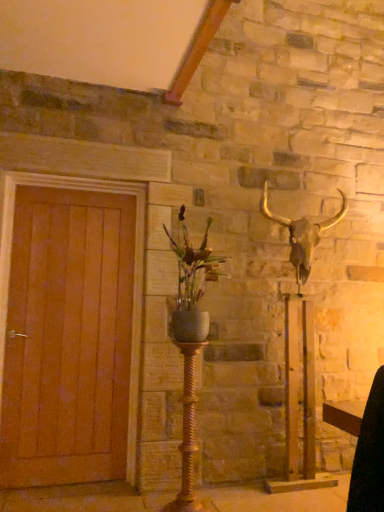
Question: Does metallic gold bull skull at upper right have a greater width compared to wooden door at left?

Choices:
 (A) yes
 (B) no

Answer: (A)

Question: Is metallic gold bull skull at upper right to the right of wooden door at left from the viewer's perspective?

Choices:
 (A) yes
 (B) no

Answer: (A)

Question: From the image's perspective, is metallic gold bull skull at upper right located above wooden door at left?

Choices:
 (A) no
 (B) yes

Answer: (A)

Question: From a real-world perspective, is metallic gold bull skull at upper right physically above wooden door at left?

Choices:
 (A) yes
 (B) no

Answer: (B)

Question: Is wooden door at left completely or partially inside metallic gold bull skull at upper right?

Choices:
 (A) no
 (B) yes

Answer: (A)

Question: Considering the positions of wooden door at left and matte gray vase at center in the image, is wooden door at left bigger or smaller than matte gray vase at center?

Choices:
 (A) big
 (B) small

Answer: (A)

Question: Is point (132, 372) closer or farther from the camera than point (185, 263)?

Choices:
 (A) closer
 (B) farther

Answer: (B)

Question: From the image's perspective, relative to matte gray vase at center, is wooden door at left above or below?

Choices:
 (A) below
 (B) above

Answer: (A)

Question: From a real-world perspective, is wooden door at left positioned above or below matte gray vase at center?

Choices:
 (A) below
 (B) above

Answer: (A)

Question: Do you think metallic gold bull skull at upper right is within wooden door at left, or outside of it?

Choices:
 (A) outside
 (B) inside

Answer: (A)

Question: From the image's perspective, is metallic gold bull skull at upper right positioned above or below wooden door at left?

Choices:
 (A) below
 (B) above

Answer: (A)

Question: In terms of size, does metallic gold bull skull at upper right appear bigger or smaller than wooden door at left?

Choices:
 (A) small
 (B) big

Answer: (B)

Question: From a real-world perspective, is metallic gold bull skull at upper right positioned above or below wooden door at left?

Choices:
 (A) below
 (B) above

Answer: (A)

Question: Would you say gold twisted metal candle holder at center is inside or outside wooden door at left?

Choices:
 (A) outside
 (B) inside

Answer: (A)

Question: Is gold twisted metal candle holder at center taller or shorter than wooden door at left?

Choices:
 (A) short
 (B) tall

Answer: (A)